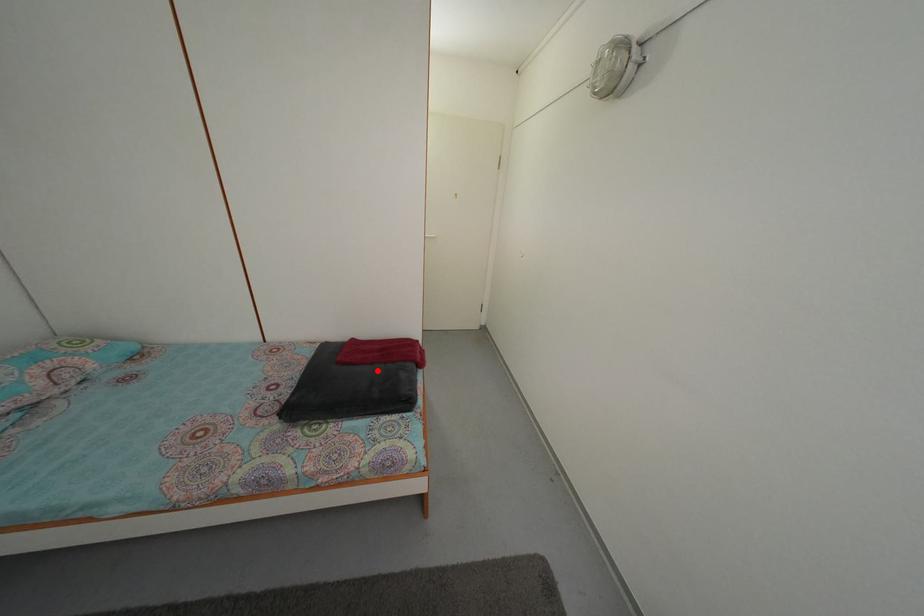
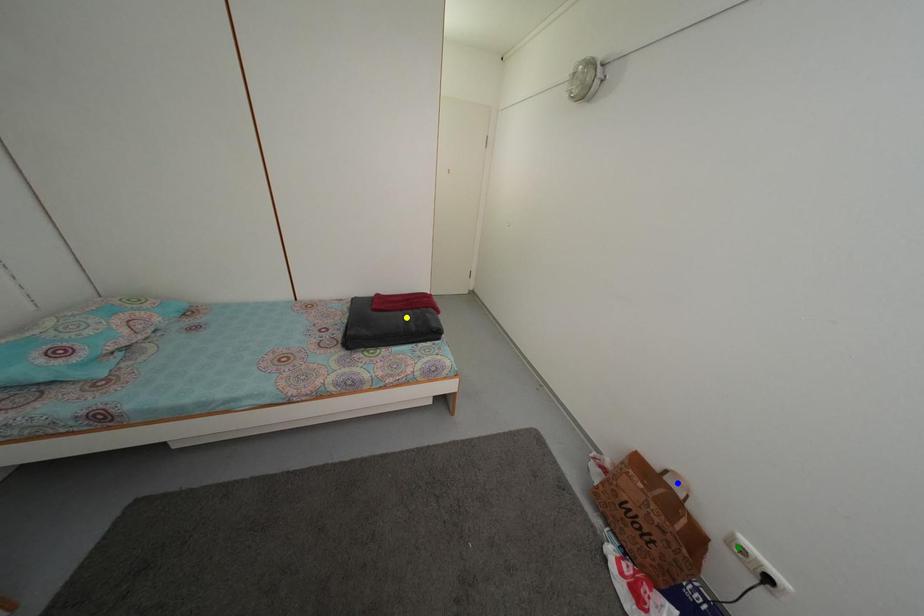
Question: I am providing you with two images of the same scene from different viewpoints. A red point is marked on the first image. You are given multiple points on the second image. Which spot in image 2 lines up with the point in image 1?

Choices:
 (A) yellow point
 (B) green point
 (C) blue point

Answer: (A)